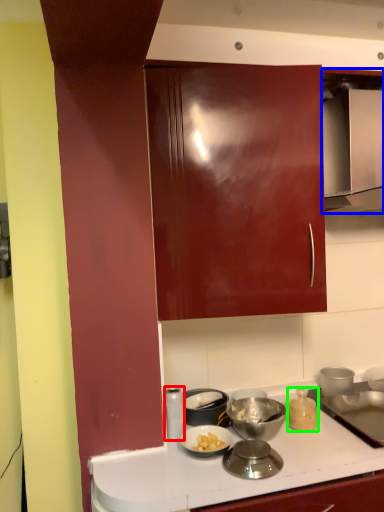
Question: Which is farther away from kitchen appliance (highlighted by a red box)? home appliance (highlighted by a blue box) or kitchen appliance (highlighted by a green box)?

Choices:
 (A) home appliance
 (B) kitchen appliance

Answer: (A)